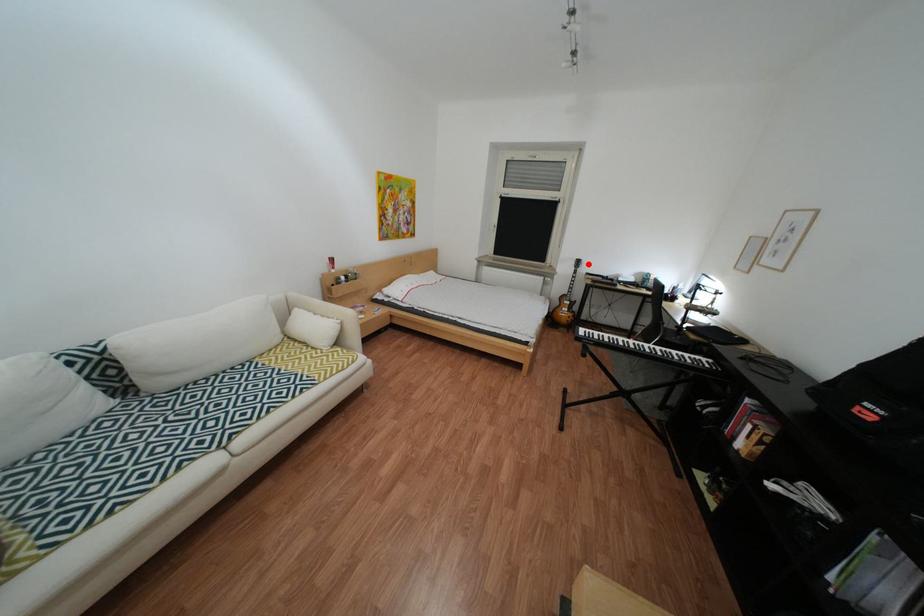
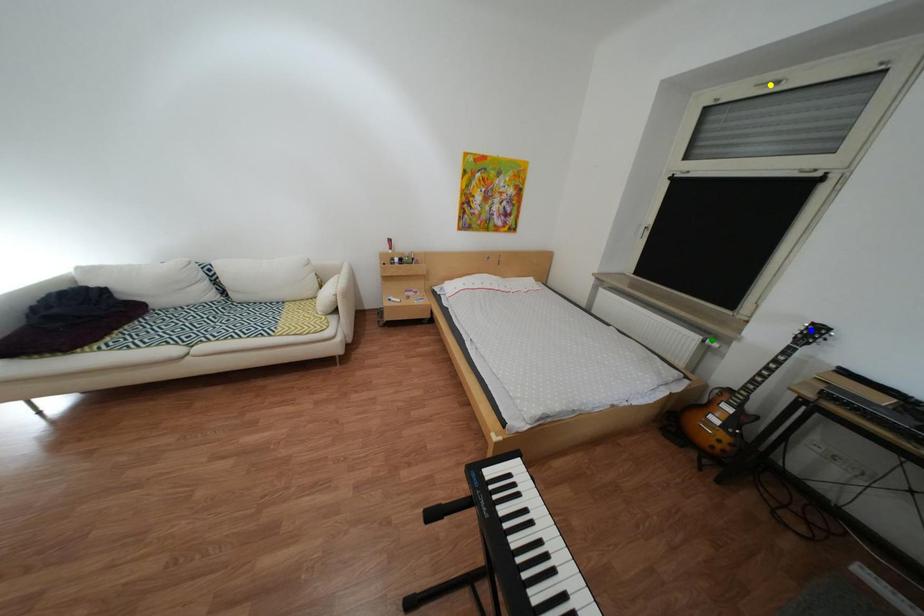
Question: I am providing you with two images of the same scene from different viewpoints. A red point is marked on the first image. You are given multiple points on the second image. Can you choose the point in image 2 that corresponds to the point in image 1?

Choices:
 (A) yellow point
 (B) blue point
 (C) green point

Answer: (B)